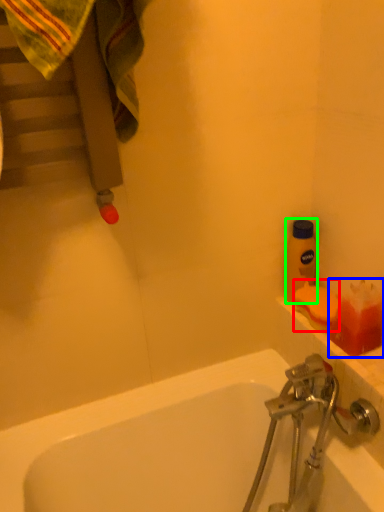
Question: Which object is the closest to the soap (highlighted by a red box)? Choose among these: toiletry (highlighted by a blue box) or bottle (highlighted by a green box).

Choices:
 (A) toiletry
 (B) bottle

Answer: (A)